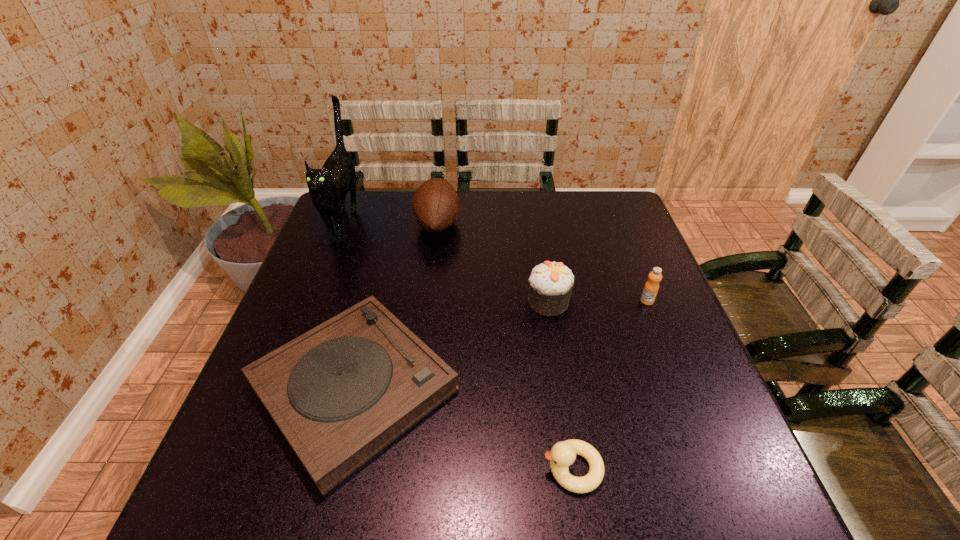
Identify the location of blank area located at the beak of the duckling. Image resolution: width=960 pixels, height=540 pixels. [x=498, y=469].

Where is `free spot located 0.100m at the beak of the duckling`? free spot located 0.100m at the beak of the duckling is located at coordinates (488, 469).

Where is `vacant space located 0.320m at the beak of the duckling`? This screenshot has width=960, height=540. vacant space located 0.320m at the beak of the duckling is located at coordinates (367, 469).

This screenshot has width=960, height=540. Find the location of `vacant space located 0.340m on the back of the shortest object`. vacant space located 0.340m on the back of the shortest object is located at coordinates (393, 230).

The height and width of the screenshot is (540, 960). What are the coordinates of `cat located at the far edge` in the screenshot? It's located at (328, 187).

The image size is (960, 540). I want to click on football that is at the far edge, so click(x=436, y=206).

At what (x,y) coordinates should I click in order to perform the action: click on duckling positioned at the near edge. Please return your answer as a coordinate pair (x, y). Looking at the image, I should click on (563, 454).

The width and height of the screenshot is (960, 540). What are the coordinates of `phonograph record located at the near edge` in the screenshot? It's located at (340, 393).

At what (x,y) coordinates should I click in order to perform the action: click on cat that is at the left edge. Please return your answer as a coordinate pair (x, y). The width and height of the screenshot is (960, 540). Looking at the image, I should click on (x=328, y=187).

I want to click on phonograph record positioned at the left edge, so click(x=340, y=393).